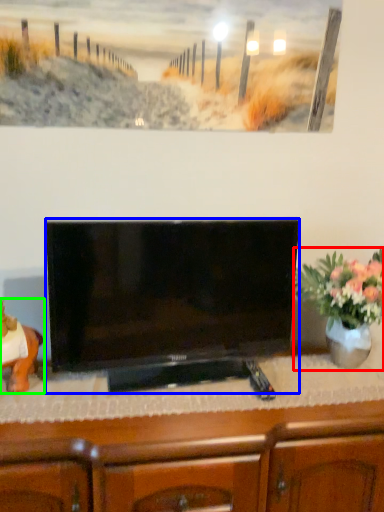
Question: Based on their relative distances, which object is nearer to houseplant (highlighted by a red box)? Choose from television (highlighted by a blue box) and animal (highlighted by a green box).

Choices:
 (A) television
 (B) animal

Answer: (A)